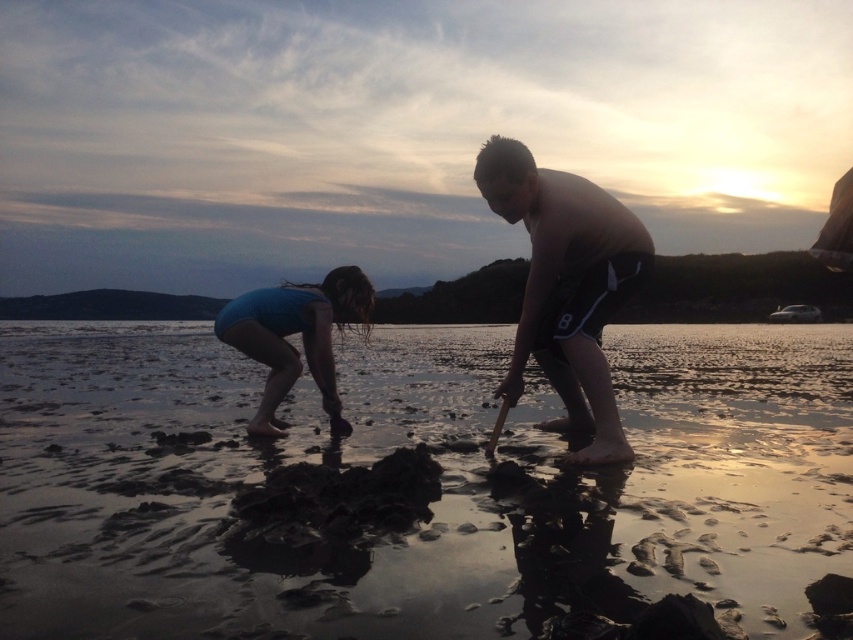
Can you confirm if shiny black shorts at center is wider than blue fabric at center?

In fact, shiny black shorts at center might be narrower than blue fabric at center.

Between shiny black shorts at center and blue fabric at center, which one is positioned higher?

shiny black shorts at center

Is point (561, 298) less distant than point (326, 392)?

Yes, point (561, 298) is in front of point (326, 392).

This screenshot has width=853, height=640. Identify the location of shiny black shorts at center. (567, 285).

Between muddy wet sand at lower center and shiny black shorts at center, which one is positioned higher?

shiny black shorts at center

Is point (482, 628) positioned before point (508, 195)?

Yes.

Between point (735, 378) and point (476, 172), which one is positioned behind?

The point (735, 378) is behind.

The image size is (853, 640). What are the coordinates of `muddy wet sand at lower center` in the screenshot? It's located at (427, 502).

Is muddy wet sand at lower center below blue fabric at center?

Correct, muddy wet sand at lower center is located below blue fabric at center.

At what (x,y) coordinates should I click in order to perform the action: click on muddy wet sand at lower center. Please return your answer as a coordinate pair (x, y). Looking at the image, I should click on (427, 502).

Which is behind, point (770, 524) or point (325, 388)?

The point (325, 388) is more distant.

Where is `muddy wet sand at lower center`? This screenshot has height=640, width=853. muddy wet sand at lower center is located at coordinates [x=427, y=502].